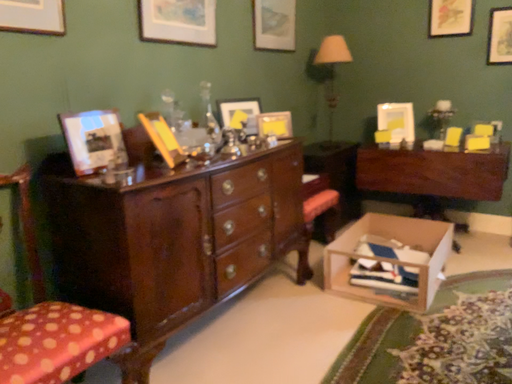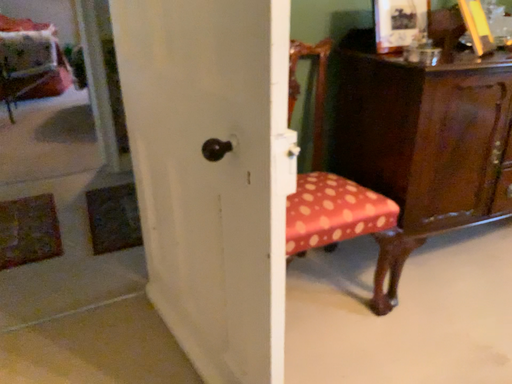
Question: Which way did the camera rotate in the video?

Choices:
 (A) rotated upward
 (B) rotated downward

Answer: (B)